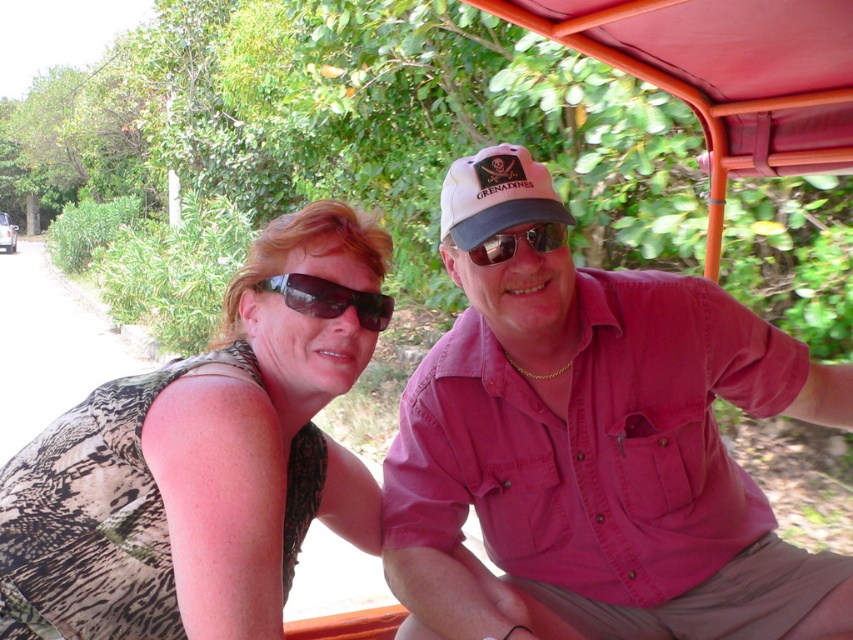
You are designing a layout for a catalog and need to place the printed fabric tank top at left and the black matte sunglasses at center next to each other. Based on their widths, which item should be placed first to ensure they fit properly?

The printed fabric tank top at left should be placed first because it is wider than the black matte sunglasses at center, ensuring there is enough space for both items in the catalog layout.

You are a photographer standing in front of the red canopy. You want to take a photo of both the pink cotton shirt at center and the black matte sunglasses at center. Which object should you focus on first to ensure both are in sharp focus?

The pink cotton shirt at center is further to the viewer than the black matte sunglasses at center. To ensure both are in sharp focus, you should focus on the pink cotton shirt at center first, as it is closer to the camera, and the depth of field will naturally include the sunglasses behind it.